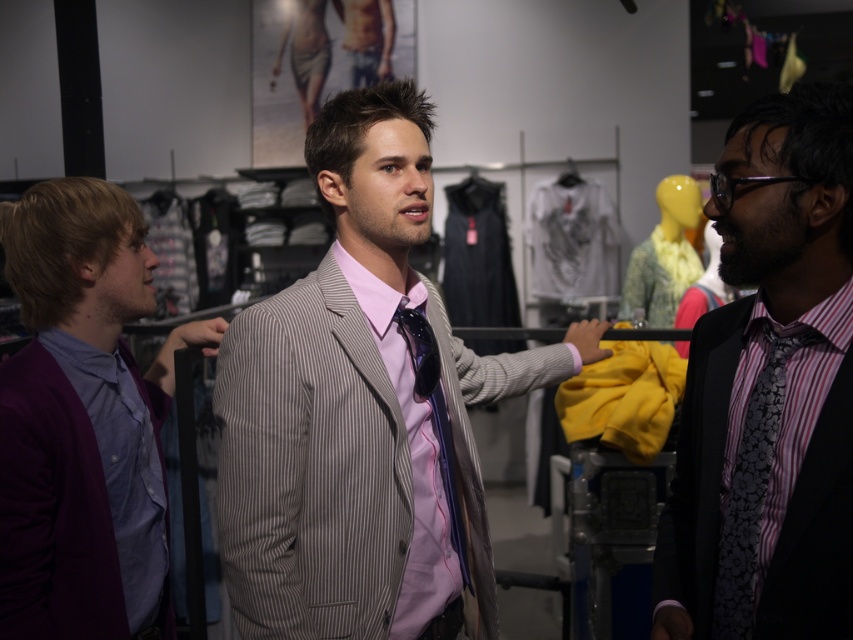
Question: Among these objects, which one is nearest to the camera?

Choices:
 (A) black textured suit at right
 (B) black floral-patterned tie at right
 (C) purple cotton dress shirt at left
 (D) purple wool sweater at left

Answer: (A)

Question: Can you confirm if purple wool sweater at left is bigger than purple cotton dress shirt at left?

Choices:
 (A) no
 (B) yes

Answer: (B)

Question: Can you confirm if striped fabric suit at center is bigger than black floral-patterned tie at right?

Choices:
 (A) yes
 (B) no

Answer: (A)

Question: Which point is closer to the camera?

Choices:
 (A) (421, 280)
 (B) (54, 337)

Answer: (B)

Question: Among these points, which one is farthest from the camera?

Choices:
 (A) (773, 364)
 (B) (158, 460)
 (C) (445, 417)
 (D) (732, 380)

Answer: (B)

Question: Considering the relative positions of black textured suit at right and purple wool sweater at left in the image provided, where is black textured suit at right located with respect to purple wool sweater at left?

Choices:
 (A) below
 (B) above

Answer: (B)